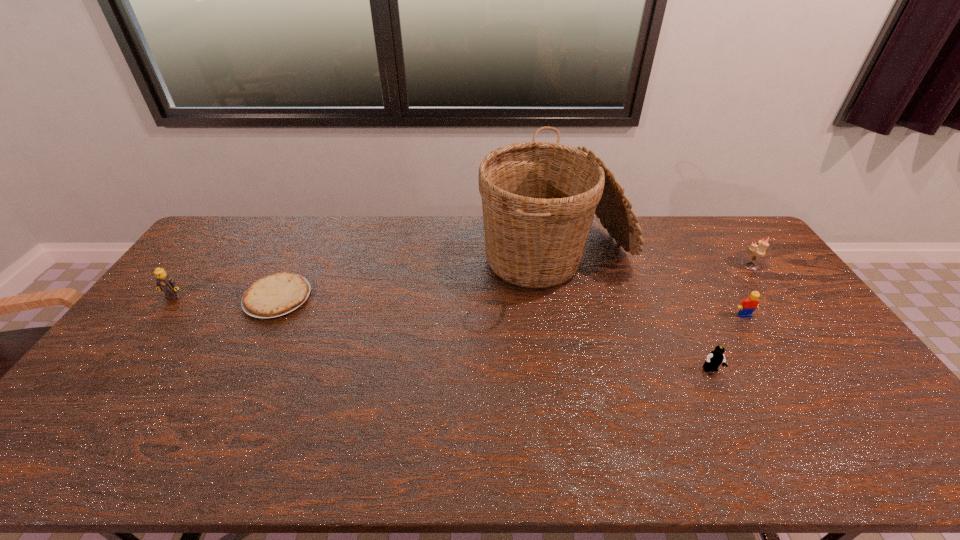
The image size is (960, 540). Find the location of `free spot that satisfies the following two spatial constraints: 1. on the back side of the tallest object; 2. on the left side of the second object from left to right`. free spot that satisfies the following two spatial constraints: 1. on the back side of the tallest object; 2. on the left side of the second object from left to right is located at coordinates (296, 261).

You are a GUI agent. You are given a task and a screenshot of the screen. Output one action in this format:
    pyautogui.click(x=<x>, y=<y>)
    Task: Click on the free space that satisfies the following two spatial constraints: 1. in front of the second object from left to right; 2. on the left side of the tallest Lego
    The height and width of the screenshot is (540, 960).
    Given the screenshot: What is the action you would take?
    pyautogui.click(x=174, y=297)

Where is `free point that satisfies the following two spatial constraints: 1. in front of the second object from left to right; 2. on the right side of the tallest Lego`? Image resolution: width=960 pixels, height=540 pixels. free point that satisfies the following two spatial constraints: 1. in front of the second object from left to right; 2. on the right side of the tallest Lego is located at coordinates click(174, 297).